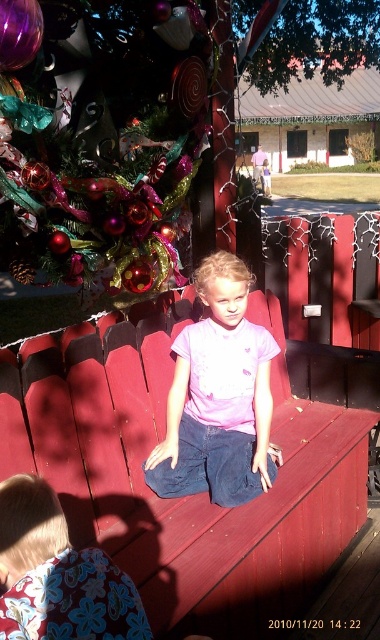
Does matte wood park bench at center have a lesser width compared to floral fabric at lower left?

Incorrect, matte wood park bench at center's width is not less than floral fabric at lower left's.

Does matte wood park bench at center have a greater height compared to floral fabric at lower left?

Indeed, matte wood park bench at center has a greater height compared to floral fabric at lower left.

Which is in front, point (213, 593) or point (69, 568)?

Positioned in front is point (69, 568).

The height and width of the screenshot is (640, 380). In order to click on matte wood park bench at center in this screenshot , I will do point(186,497).

How far apart are matte wood park bench at center and pink matte shirt at center?

matte wood park bench at center and pink matte shirt at center are 10.66 inches apart.

Is matte wood park bench at center to the left of pink matte shirt at center from the viewer's perspective?

Incorrect, matte wood park bench at center is not on the left side of pink matte shirt at center.

Is point (232, 616) less distant than point (172, 392)?

Yes, it is.

At what (x,y) coordinates should I click in order to perform the action: click on matte wood park bench at center. Please return your answer as a coordinate pair (x, y). Looking at the image, I should click on (186, 497).

Looking at this image, is shiny metallic ornaments at upper left behind floral fabric at lower left?

That is True.

Where is `shiny metallic ornaments at upper left`? The image size is (380, 640). shiny metallic ornaments at upper left is located at coordinates (102, 141).

I want to click on shiny metallic ornaments at upper left, so click(102, 141).